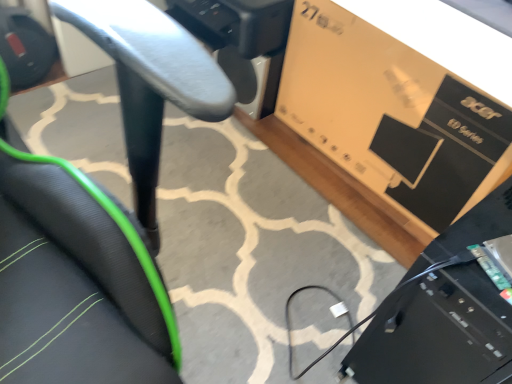
Question: From the image's perspective, is black plastic computer at lower right located beneath matte brown cardboard box at upper right?

Choices:
 (A) yes
 (B) no

Answer: (A)

Question: Is the position of black plastic computer at lower right more distant than that of matte brown cardboard box at upper right?

Choices:
 (A) no
 (B) yes

Answer: (A)

Question: From a real-world perspective, is black plastic computer at lower right below matte brown cardboard box at upper right?

Choices:
 (A) no
 (B) yes

Answer: (A)

Question: Does black plastic computer at lower right have a greater height compared to matte brown cardboard box at upper right?

Choices:
 (A) no
 (B) yes

Answer: (B)

Question: Considering the relative sizes of black plastic computer at lower right and matte brown cardboard box at upper right in the image provided, is black plastic computer at lower right smaller than matte brown cardboard box at upper right?

Choices:
 (A) yes
 (B) no

Answer: (B)

Question: Is black plastic computer at lower right shorter than matte brown cardboard box at upper right?

Choices:
 (A) no
 (B) yes

Answer: (A)

Question: Is black mesh chair at center shorter than matte brown cardboard box at upper right?

Choices:
 (A) no
 (B) yes

Answer: (B)

Question: Does black mesh chair at center turn towards matte brown cardboard box at upper right?

Choices:
 (A) yes
 (B) no

Answer: (B)

Question: Does black mesh chair at center have a greater width compared to matte brown cardboard box at upper right?

Choices:
 (A) no
 (B) yes

Answer: (B)

Question: Is black mesh chair at center at the right side of matte brown cardboard box at upper right?

Choices:
 (A) yes
 (B) no

Answer: (B)

Question: Are black mesh chair at center and matte brown cardboard box at upper right located far from each other?

Choices:
 (A) no
 (B) yes

Answer: (A)

Question: Does black mesh chair at center have a greater height compared to matte brown cardboard box at upper right?

Choices:
 (A) yes
 (B) no

Answer: (B)

Question: From the image's perspective, is matte brown cardboard box at upper right under black mesh chair at center?

Choices:
 (A) yes
 (B) no

Answer: (B)